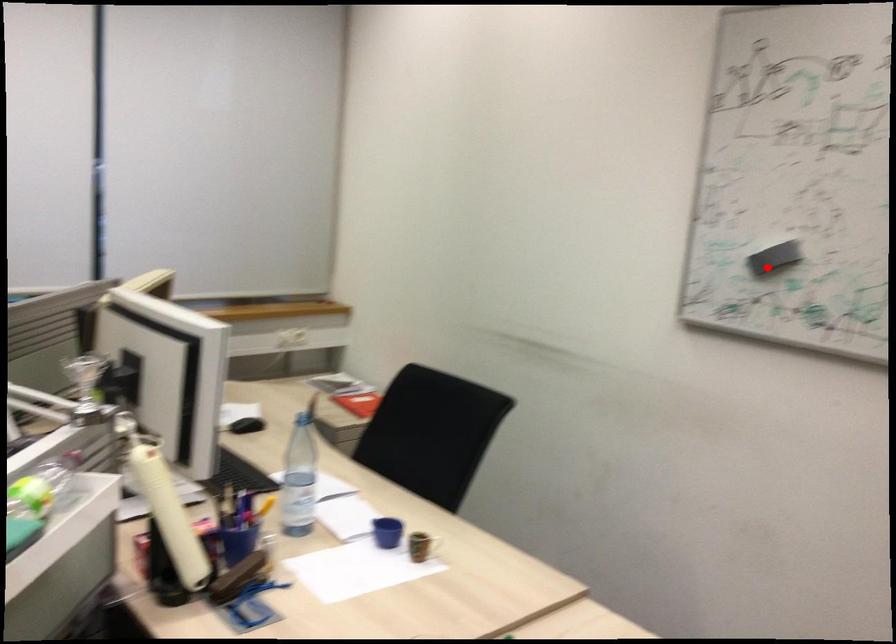
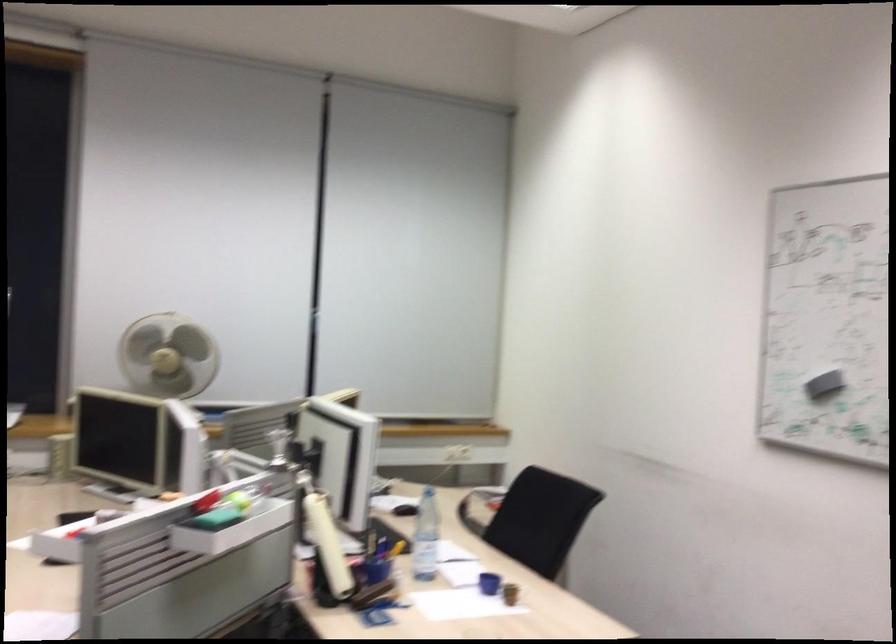
Locate, in the second image, the point that corresponds to the highlighted location in the first image.

(823, 384)